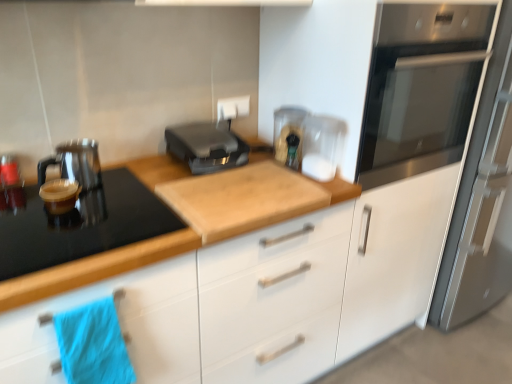
Question: Relative to wooden cutting board at center, is stainless steel fridge at right in front or behind?

Choices:
 (A) behind
 (B) front

Answer: (A)

Question: From a real-world perspective, is stainless steel fridge at right positioned above or below wooden cutting board at center?

Choices:
 (A) above
 (B) below

Answer: (A)

Question: Based on their relative distances, which object is nearer to the blue fabric towel at lower left?

Choices:
 (A) black plastic toaster at center, the 1th kitchen appliance viewed from the right
 (B) stainless steel oven at upper right
 (C) stainless steel fridge at right
 (D) black glass gas stove at left
 (E) matte black kettle at left, which is the 2th kitchen appliance in right-to-left order

Answer: (D)

Question: Which is farther from the white plastic electric outlet at upper center?

Choices:
 (A) matte black kettle at left, which is the 2th kitchen appliance in right-to-left order
 (B) blue fabric towel at lower left
 (C) wooden cutting board at center
 (D) stainless steel fridge at right
 (E) black plastic toaster at center, the 1th kitchen appliance viewed from the right

Answer: (D)